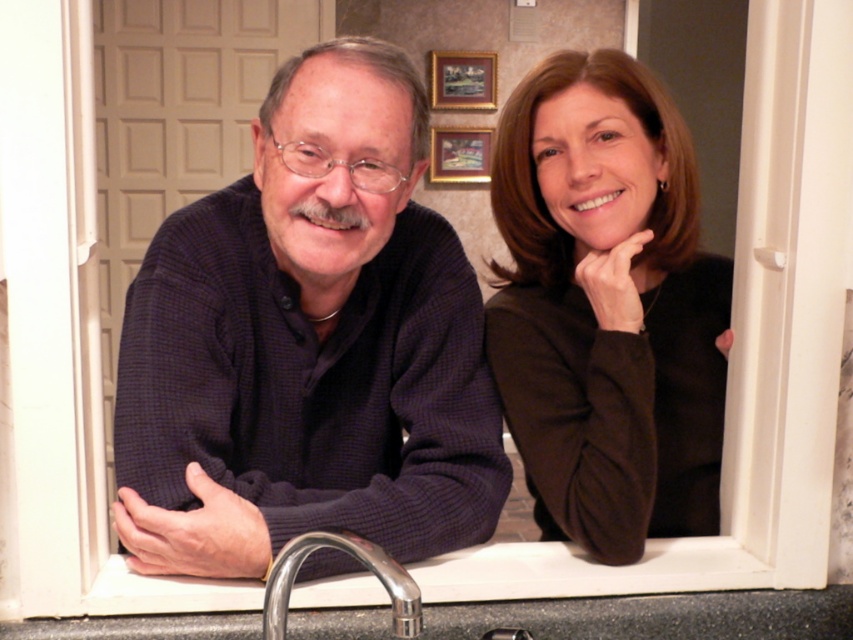
Is matte brown sweater at right smaller than polished chrome faucet at lower center?

No, matte brown sweater at right is not smaller than polished chrome faucet at lower center.

Does point (587, 490) come closer to viewer compared to point (306, 536)?

That is False.

You are a GUI agent. You are given a task and a screenshot of the screen. Output one action in this format:
    pyautogui.click(x=<x>, y=<y>)
    Task: Click on the matte brown sweater at right
    
    Given the screenshot: What is the action you would take?
    pyautogui.click(x=607, y=307)

Which is behind, point (625, 140) or point (525, 116)?

Positioned behind is point (525, 116).

Does dark blue sweater at center have a larger size compared to matte brown sweater at right?

Indeed, dark blue sweater at center has a larger size compared to matte brown sweater at right.

Image resolution: width=853 pixels, height=640 pixels. I want to click on dark blue sweater at center, so click(x=426, y=330).

Is dark blue sweater at center to the left of polished chrome faucet at lower center from the viewer's perspective?

Incorrect, dark blue sweater at center is not on the left side of polished chrome faucet at lower center.

Is dark blue sweater at center thinner than polished chrome faucet at lower center?

No, dark blue sweater at center is not thinner than polished chrome faucet at lower center.

The height and width of the screenshot is (640, 853). I want to click on dark blue sweater at center, so click(x=426, y=330).